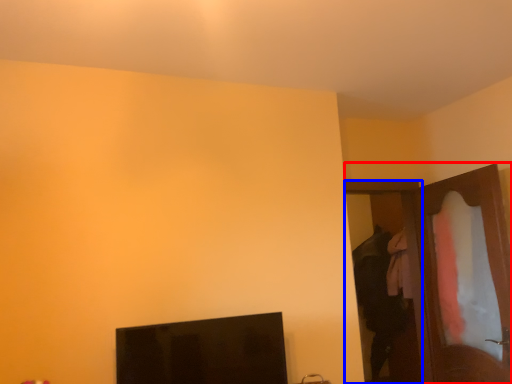
Question: Among these objects, which one is farthest to the camera, dresser (highlighted by a red box) or door (highlighted by a blue box)?

Choices:
 (A) dresser
 (B) door

Answer: (B)